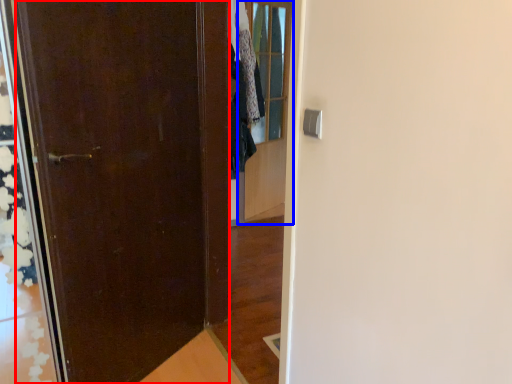
Question: Among these objects, which one is farthest to the camera, door (highlighted by a red box) or glass door (highlighted by a blue box)?

Choices:
 (A) door
 (B) glass door

Answer: (B)